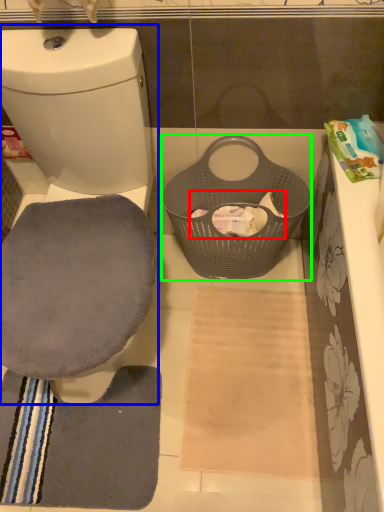
Question: Considering the real-world distances, which object is farthest from toilet paper (highlighted by a red box)? toilet (highlighted by a blue box) or basket (highlighted by a green box)?

Choices:
 (A) toilet
 (B) basket

Answer: (A)